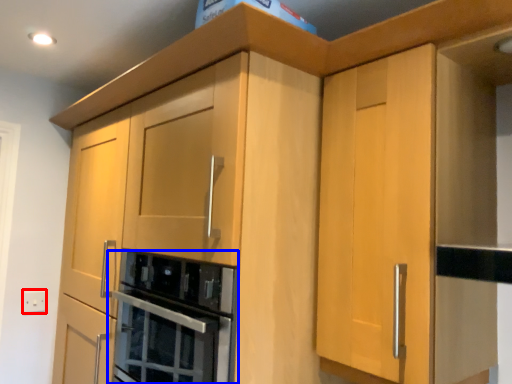
Question: Among these objects, which one is farthest to the camera, electric outlet (highlighted by a red box) or home appliance (highlighted by a blue box)?

Choices:
 (A) electric outlet
 (B) home appliance

Answer: (A)